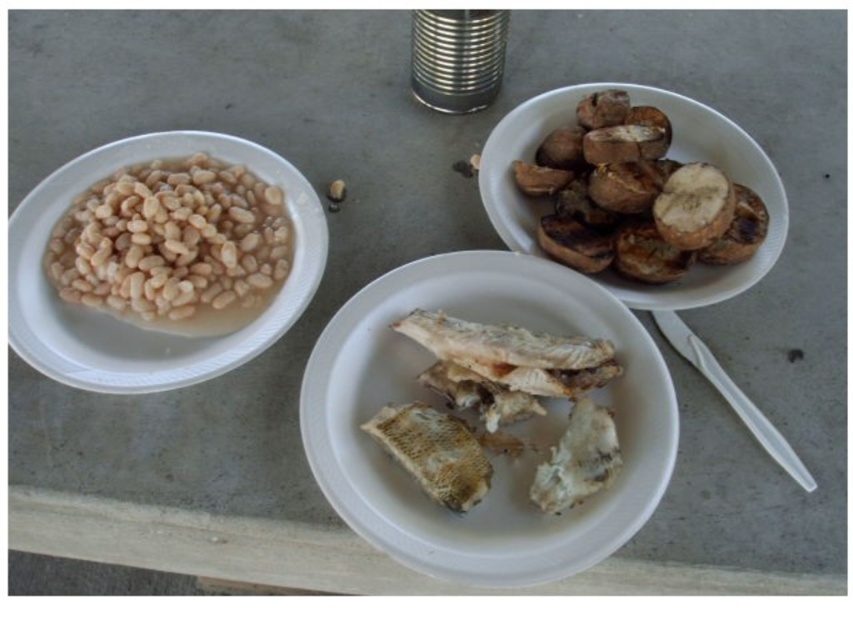
You are a food delivery robot positioned at the center of the table. You need to pick up an item from the point closer to you. Which point should you go to, point (410, 330) or point (62, 356)?

Point (410, 330) is further to the camera than point (62, 356), so the point closer to you is point (62, 356). You should go to point (62, 356).

You are a person with a small hand trying to pick up either the white plastic fork at lower right or the matte brown nut at center. Which object is easier to grip based on their sizes?

The white plastic fork at lower right is larger in width than the matte brown nut at center, making it easier to grip for someone with a small hand.